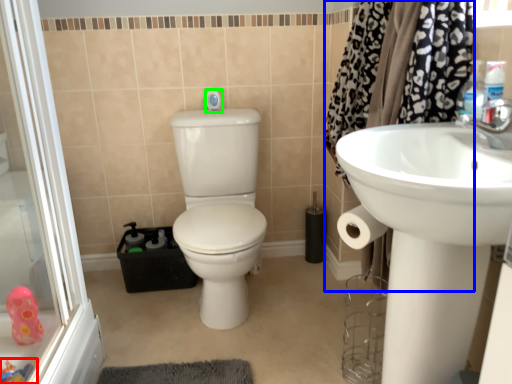
Question: Which is nearer to the toy (highlighted by a red box)? shower curtain (highlighted by a blue box) or shower (highlighted by a green box).

Choices:
 (A) shower curtain
 (B) shower

Answer: (B)